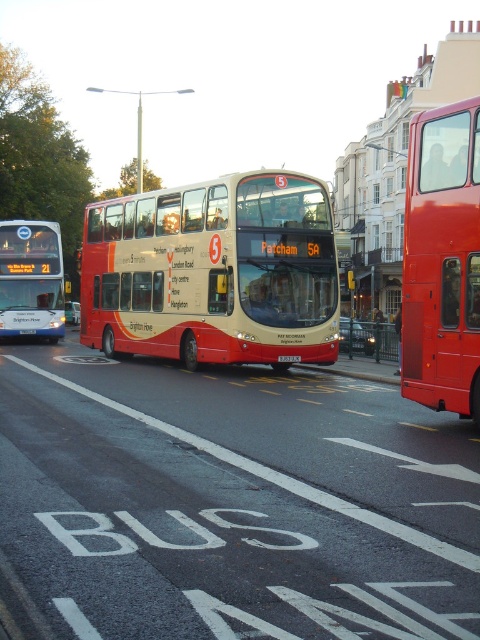
Question: Based on their relative distances, which object is farther from the black plastic license plate at center?

Choices:
 (A) matte white bus at left
 (B) beige matte bus at center

Answer: (A)

Question: Is beige matte bus at center smaller than white plastic license plate at center?

Choices:
 (A) yes
 (B) no

Answer: (B)

Question: Is beige matte bus at center closer to the viewer compared to red matte bus at right?

Choices:
 (A) no
 (B) yes

Answer: (A)

Question: Is beige matte bus at center above matte white bus at left?

Choices:
 (A) no
 (B) yes

Answer: (A)

Question: Which point is farther to the camera?

Choices:
 (A) (15, 324)
 (B) (240, 352)
 (C) (291, 358)

Answer: (A)

Question: Which of the following is the farthest from the observer?

Choices:
 (A) (425, 397)
 (B) (25, 321)
 (C) (294, 358)

Answer: (B)